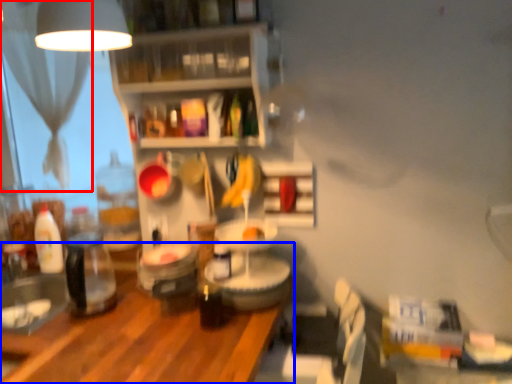
Question: Which of the following is the farthest to the observer, curtain (highlighted by a red box) or table (highlighted by a blue box)?

Choices:
 (A) curtain
 (B) table

Answer: (A)